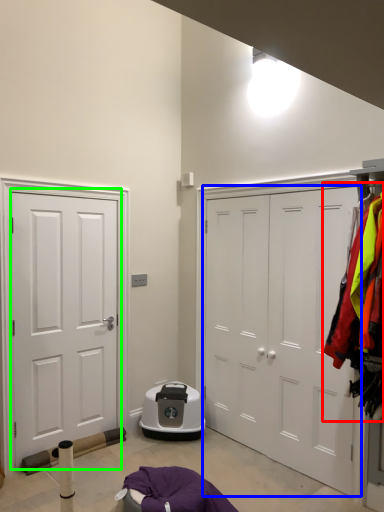
Question: Which is nearer to the laundry (highlighted by a red box)? door (highlighted by a blue box) or door (highlighted by a green box).

Choices:
 (A) door
 (B) door

Answer: (A)